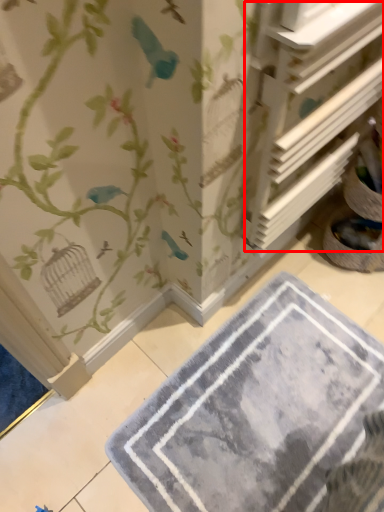
Question: From the image, what is the correct spatial relationship of shelf (annotated by the red box) in relation to bath mat?

Choices:
 (A) right
 (B) left

Answer: (A)